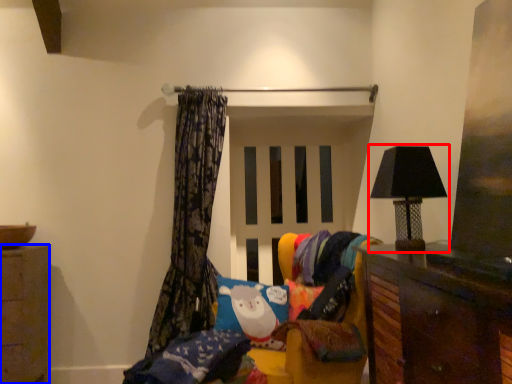
Question: Which point is closer to the camera, lamp (highlighted by a red box) or cabinetry (highlighted by a blue box)?

Choices:
 (A) lamp
 (B) cabinetry

Answer: (A)